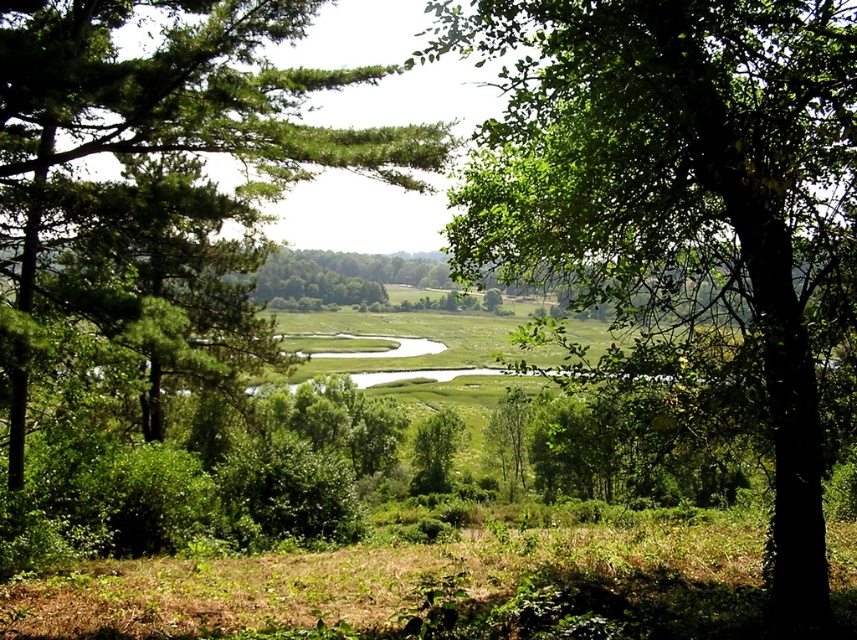
You are standing in the forest looking through the trees. You see a point marked at coordinates (x=682, y=196). What object is located at that point?

The point at coordinates (x=682, y=196) indicates a green leafy tree at center.

You are standing in a forest clearing and see two trees ahead of you. The first is the green leafy tree at center, and the second is the green leafy tree at left. Which tree is closer to you?

The green leafy tree at center is positioned over the green leafy tree at left, meaning it is closer to you.

Consider the image. What are the coordinates of the green leafy tree at center in the image?

The green leafy tree at center is located at coordinates point (682, 196).